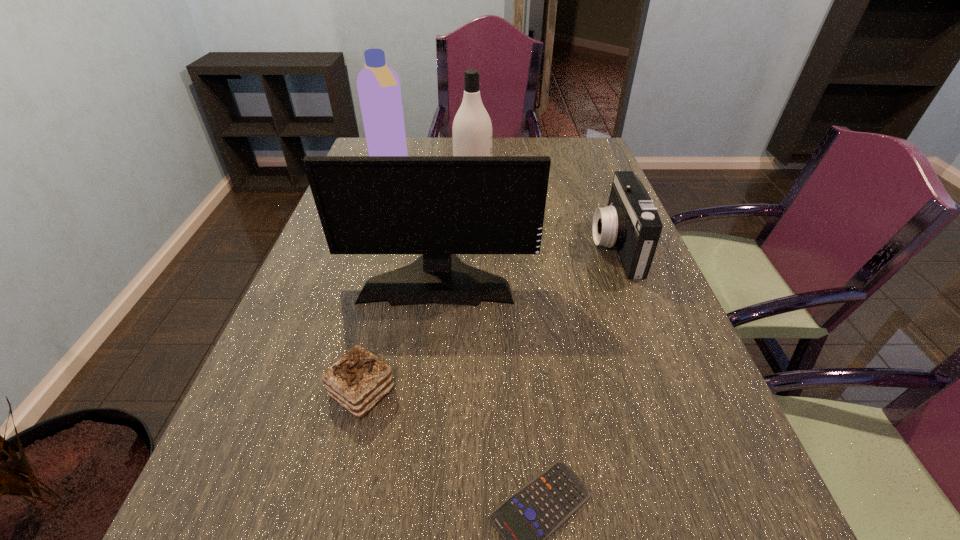
Locate an element on the screen. The image size is (960, 540). vacant space that satisfies the following two spatial constraints: 1. on the front side of the fifth tallest object; 2. on the right side of the farthest object is located at coordinates (311, 393).

Identify the location of free space that satisfies the following two spatial constraints: 1. on the front-facing side of the fifth nearest object; 2. on the screen side of the monitor. The image size is (960, 540). (471, 277).